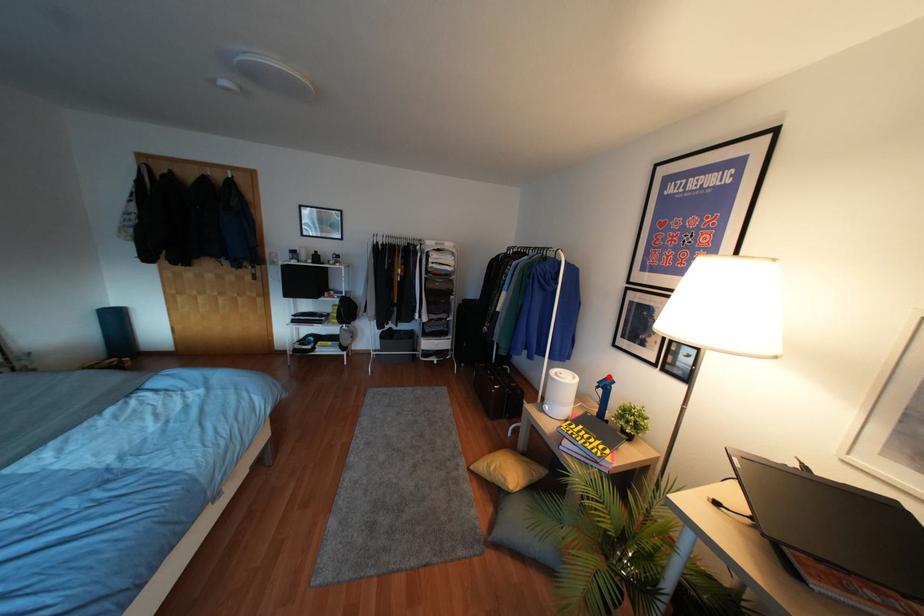
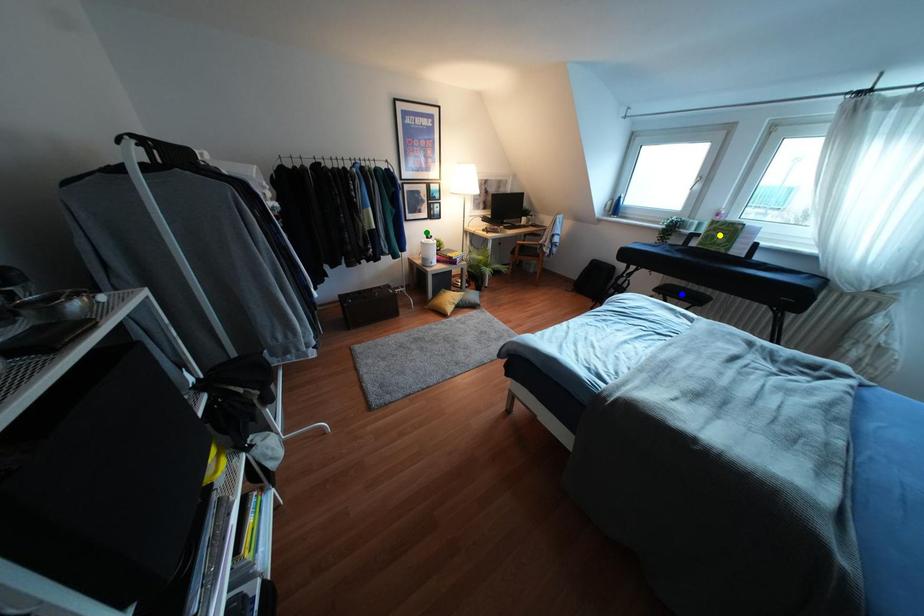
Question: I am providing you with two images of the same scene from different viewpoints. A red point is marked on the first image. You are given multiple points on the second image. Which point in image 2 represents the same 3d spot as the red point in image 1?

Choices:
 (A) blue point
 (B) green point
 (C) yellow point

Answer: (B)